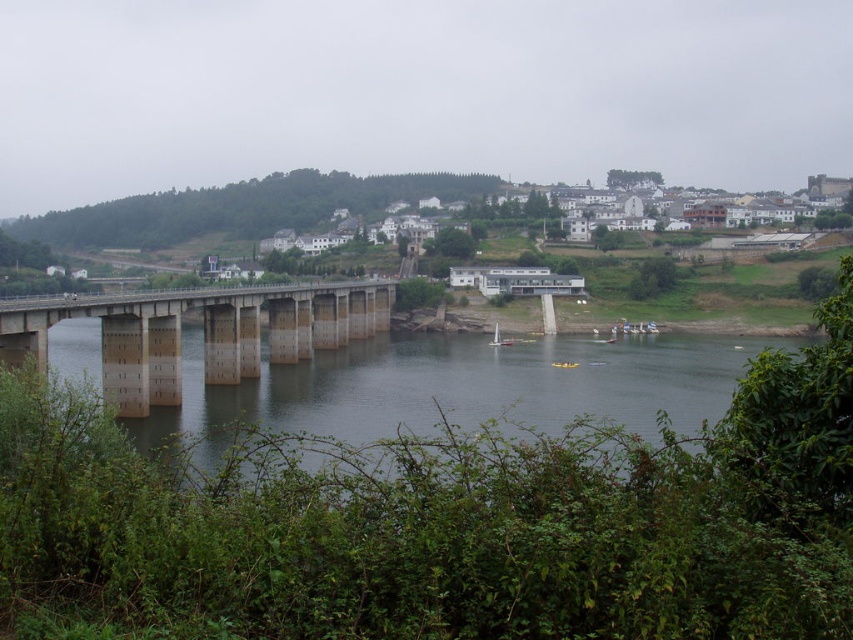
Question: Does dark gray concrete bridge at center come in front of concrete bridge at center?

Choices:
 (A) yes
 (B) no

Answer: (A)

Question: Which of the following is the closest to the observer?

Choices:
 (A) dark gray concrete bridge at center
 (B) concrete bridge at center

Answer: (A)

Question: Considering the relative positions of dark gray concrete bridge at center and concrete bridge at center in the image provided, where is dark gray concrete bridge at center located with respect to concrete bridge at center?

Choices:
 (A) above
 (B) below

Answer: (B)

Question: Can you confirm if dark gray concrete bridge at center is positioned below concrete bridge at center?

Choices:
 (A) yes
 (B) no

Answer: (A)